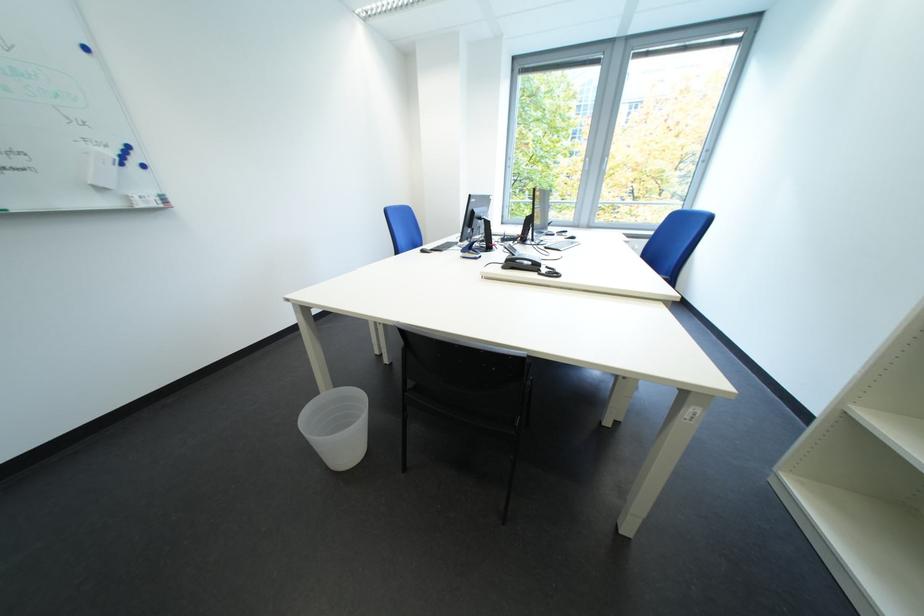
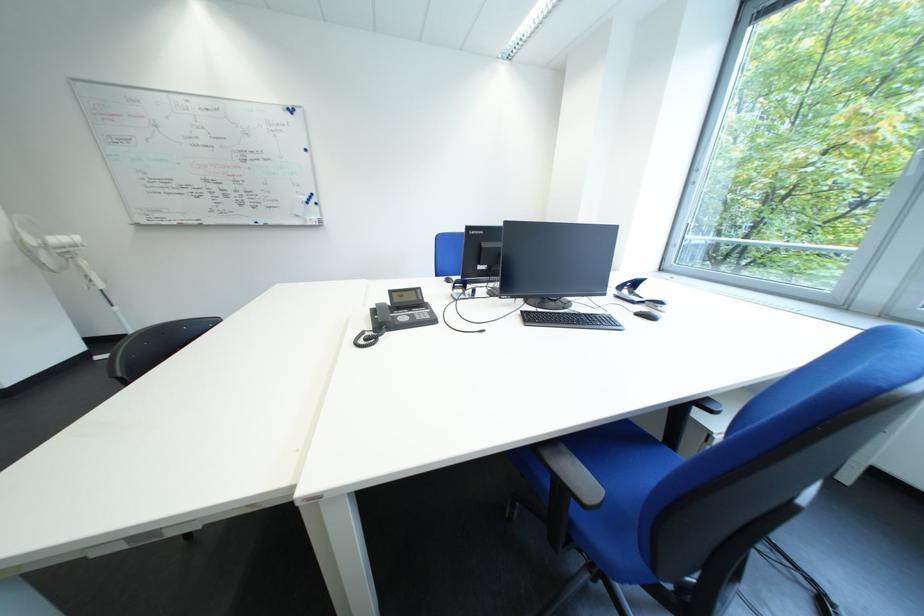
Locate, in the second image, the point that corresponds to the point at 565,237 in the first image.

(645, 305)